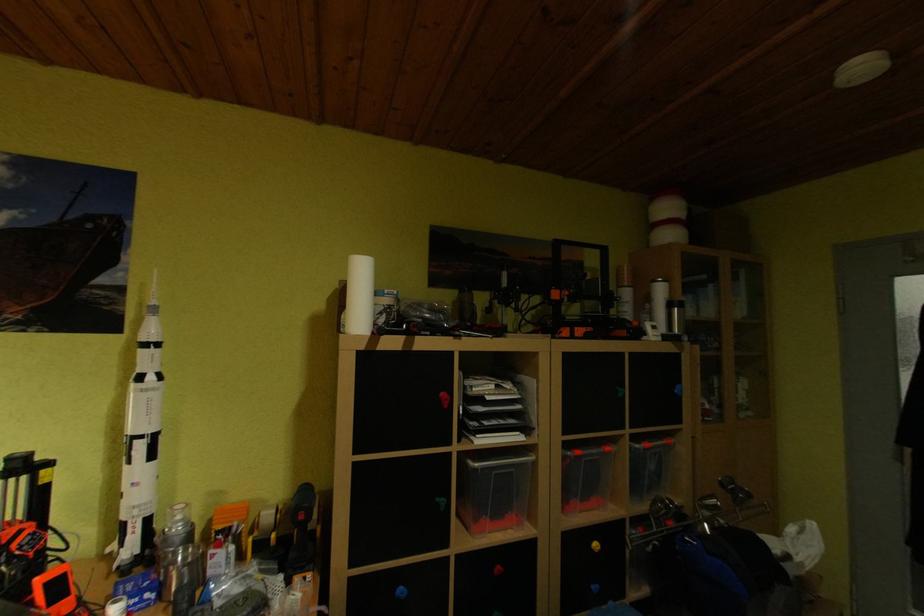
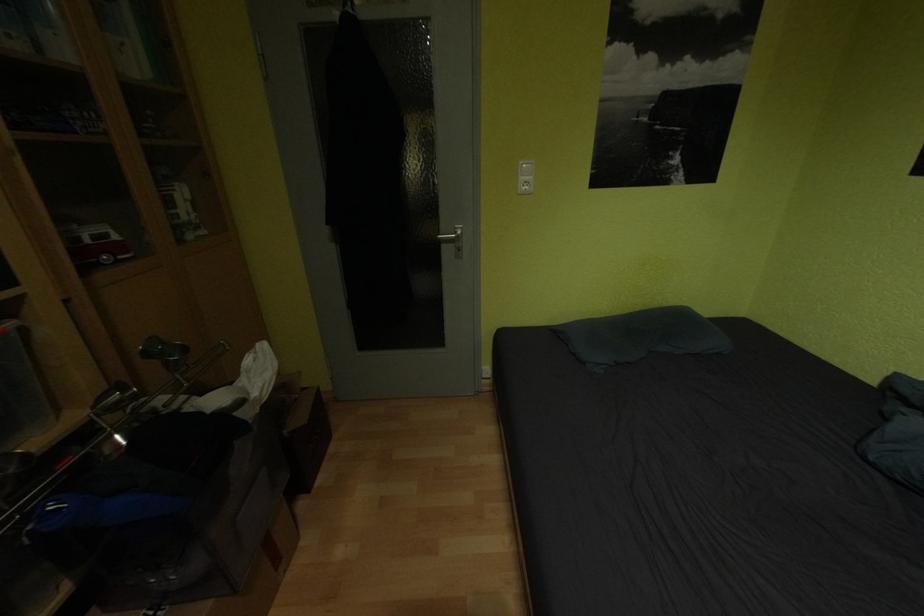
The first image is from the beginning of the video and the second image is from the end. How did the camera likely rotate when shooting the video?

The camera rotated toward right-down.